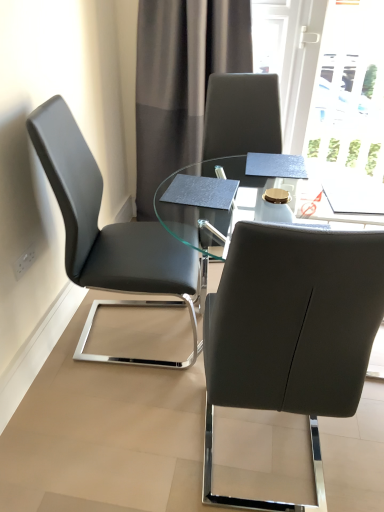
This screenshot has height=512, width=384. Identify the location of vacant space situated on the left part of matte black chair at center, the second chair when ordered from left to right. (131, 442).